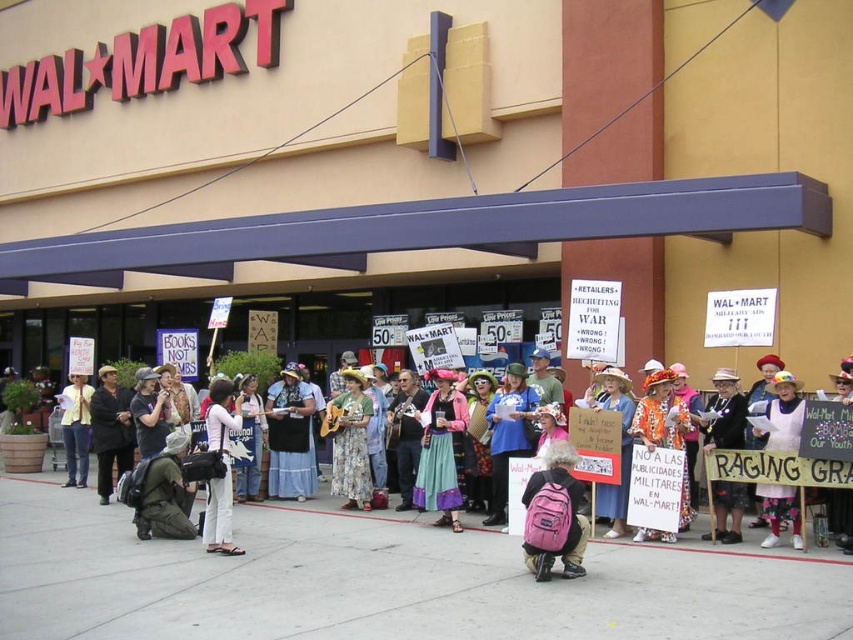
You are a photographer standing at the entrance of the Walmart store. You want to capture a photo of the protesters holding signs, including the pink fabric backpack at lower center. Which direction should you move to ensure the backpack is centered in your shot?

The pink fabric backpack at lower center is located at point (556, 513), so you should move to the right and slightly upward to center it in your shot.

You are a photographer standing at the entrance of the Walmart store. You want to take a photo that includes both the pink fabric backpack at lower center and the floral dress at center. Given their distance apart, will you need to zoom in or zoom out to capture both subjects in the frame?

The pink fabric backpack at lower center and the floral dress at center are 5.30 meters apart. To capture both in the frame, you would need to zoom out to widen the field of view.